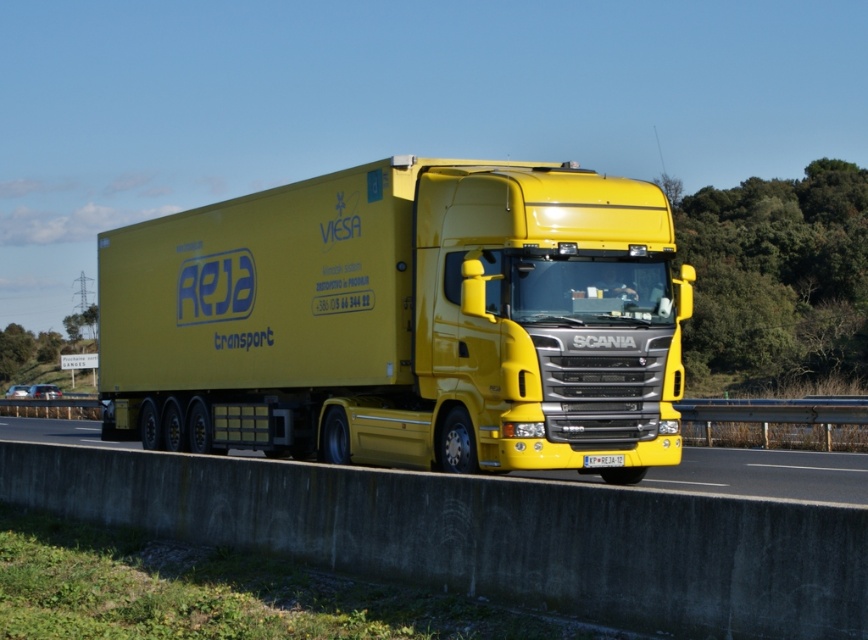
Question: Does yellow matte truck at center have a smaller size compared to yellow glossy concrete barrier at lower center?

Choices:
 (A) no
 (B) yes

Answer: (B)

Question: Does yellow matte truck at center have a greater width compared to yellow glossy concrete barrier at lower center?

Choices:
 (A) yes
 (B) no

Answer: (B)

Question: Which point is farther to the camera?

Choices:
 (A) (400, 195)
 (B) (669, 486)

Answer: (A)

Question: Among these points, which one is nearest to the camera?

Choices:
 (A) (57, 419)
 (B) (132, 300)

Answer: (B)

Question: Which point is closer to the camera?

Choices:
 (A) (30, 428)
 (B) (196, 365)

Answer: (B)

Question: Is yellow matte truck at center wider than yellow glossy concrete barrier at lower center?

Choices:
 (A) no
 (B) yes

Answer: (A)